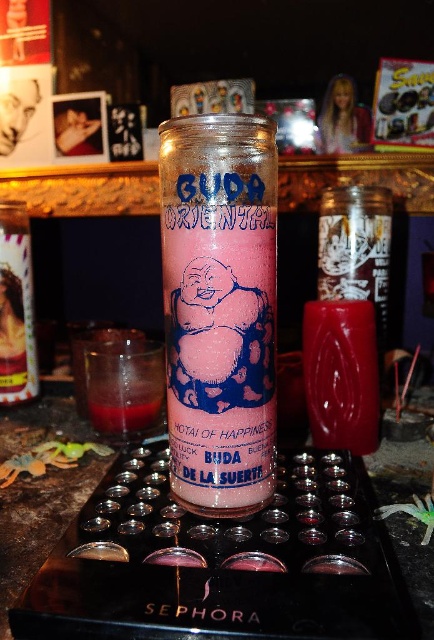
Which of these two, pink glitter candle at center or translucent glass tray at center, stands taller?

With more height is pink glitter candle at center.

Does pink glitter candle at center have a larger size compared to translucent glass tray at center?

Incorrect, pink glitter candle at center is not larger than translucent glass tray at center.

What do you see at coordinates (220, 307) in the screenshot?
I see `pink glitter candle at center` at bounding box center [220, 307].

Locate an element on the screen. This screenshot has width=434, height=640. pink glitter candle at center is located at coordinates (220, 307).